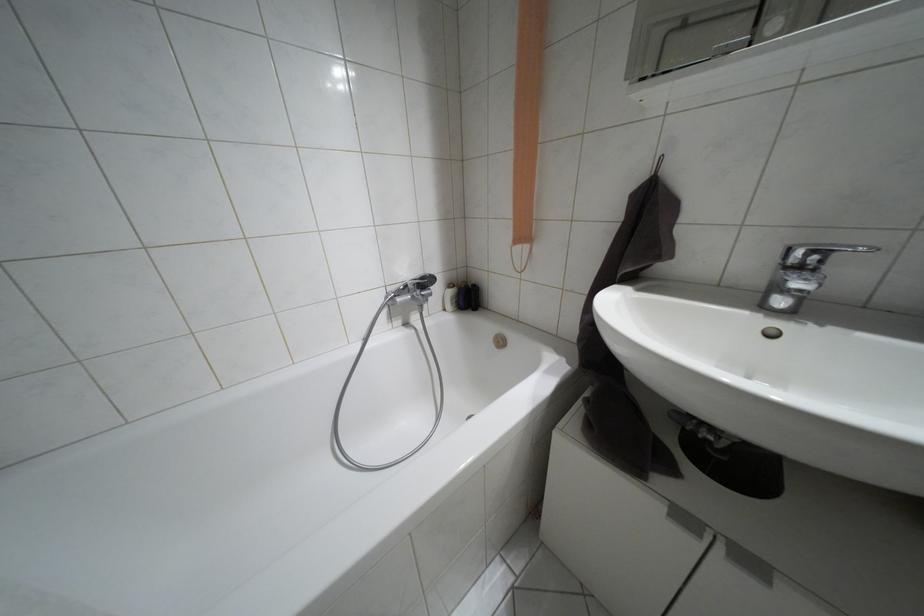
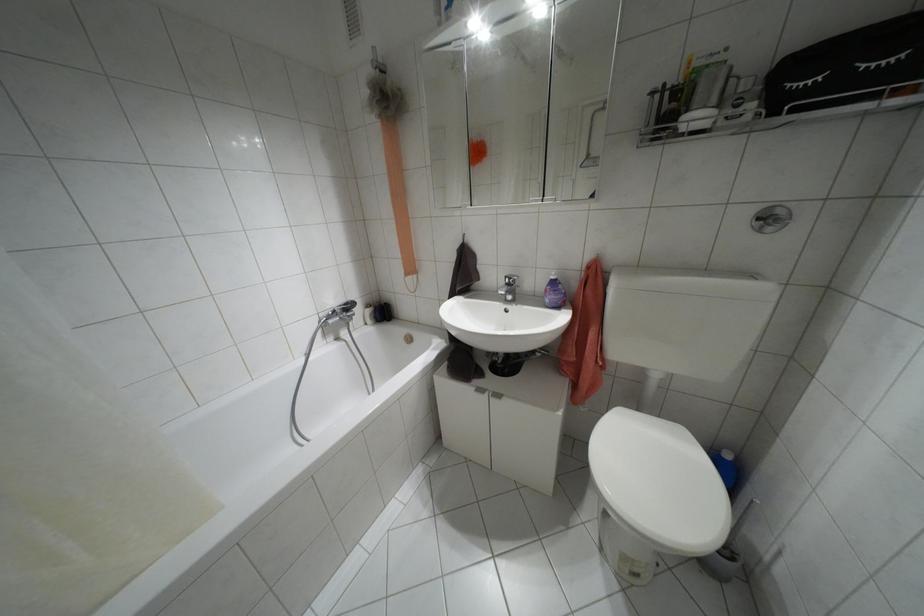
In the second image, find the point that corresponds to (448,285) in the first image.

(367, 305)